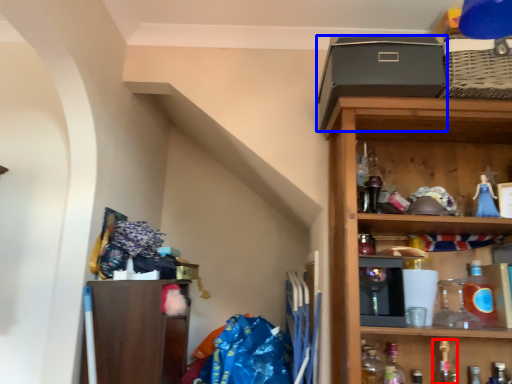
Question: Which object appears closest to the camera in this image, bottle (highlighted by a red box) or box (highlighted by a blue box)?

Choices:
 (A) bottle
 (B) box

Answer: (B)